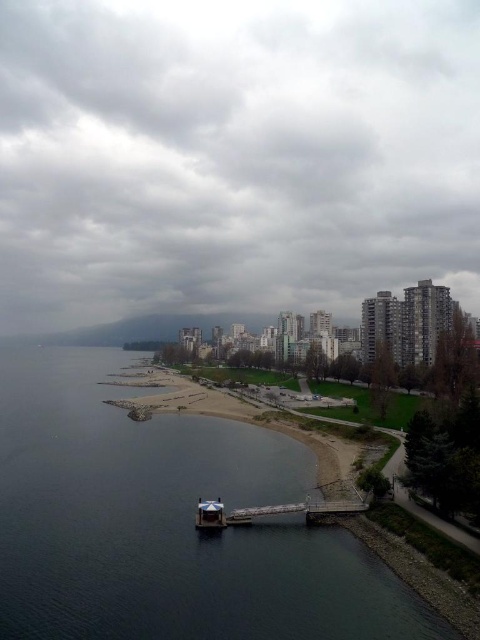
Question: Is cloudy sky at upper center thinner than wooden pier at lower center?

Choices:
 (A) yes
 (B) no

Answer: (B)

Question: Does dark gray concrete pier at lower left have a lesser width compared to wooden pier at lower center?

Choices:
 (A) yes
 (B) no

Answer: (B)

Question: Estimate the real-world distances between objects in this image. Which object is closer to the cloudy sky at upper center?

Choices:
 (A) wooden pier at lower center
 (B) metallic blue boat at lower center

Answer: (A)

Question: Which point is farther to the camera?

Choices:
 (A) metallic blue boat at lower center
 (B) wooden pier at lower center
 (C) cloudy sky at upper center

Answer: (C)

Question: Estimate the real-world distances between objects in this image. Which object is closer to the metallic blue boat at lower center?

Choices:
 (A) dark gray concrete pier at lower left
 (B) cloudy sky at upper center
 (C) wooden pier at lower center

Answer: (C)

Question: In this image, where is dark gray concrete pier at lower left located relative to wooden pier at lower center?

Choices:
 (A) right
 (B) left

Answer: (B)